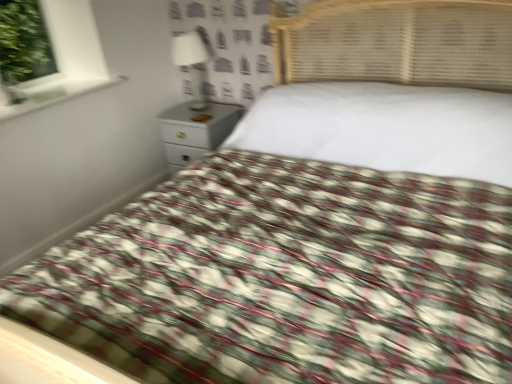
Question: From the image's perspective, is white glossy nightstand at upper center located above white glossy window sill at upper left?

Choices:
 (A) yes
 (B) no

Answer: (B)

Question: From the image's perspective, is white glossy nightstand at upper center below white glossy window sill at upper left?

Choices:
 (A) yes
 (B) no

Answer: (A)

Question: From a real-world perspective, is white glossy nightstand at upper center on top of white glossy window sill at upper left?

Choices:
 (A) yes
 (B) no

Answer: (B)

Question: Is white glossy nightstand at upper center to the left of white glossy window sill at upper left from the viewer's perspective?

Choices:
 (A) no
 (B) yes

Answer: (A)

Question: Does white glossy nightstand at upper center have a larger size compared to white glossy window sill at upper left?

Choices:
 (A) yes
 (B) no

Answer: (A)

Question: In terms of height, does white glossy lamp at upper center look taller or shorter compared to white glossy window sill at upper left?

Choices:
 (A) short
 (B) tall

Answer: (B)

Question: Considering the positions of white glossy lamp at upper center and white glossy window sill at upper left in the image, is white glossy lamp at upper center wider or thinner than white glossy window sill at upper left?

Choices:
 (A) wide
 (B) thin

Answer: (B)

Question: From a real-world perspective, relative to white glossy window sill at upper left, is white glossy lamp at upper center vertically above or below?

Choices:
 (A) above
 (B) below

Answer: (B)

Question: From the image's perspective, relative to white glossy window sill at upper left, is white glossy lamp at upper center above or below?

Choices:
 (A) below
 (B) above

Answer: (B)

Question: From the image's perspective, is white glossy window sill at upper left positioned above or below white glossy nightstand at upper center?

Choices:
 (A) below
 (B) above

Answer: (B)

Question: Is point (35, 79) positioned closer to the camera than point (163, 135)?

Choices:
 (A) farther
 (B) closer

Answer: (B)

Question: In terms of size, does white glossy window sill at upper left appear bigger or smaller than white glossy nightstand at upper center?

Choices:
 (A) small
 (B) big

Answer: (A)

Question: In the image, is white glossy window sill at upper left positioned in front of or behind white glossy nightstand at upper center?

Choices:
 (A) behind
 (B) front

Answer: (B)

Question: From a real-world perspective, is white glossy lamp at upper center physically located above or below white glossy nightstand at upper center?

Choices:
 (A) below
 (B) above

Answer: (B)

Question: From the image's perspective, is white glossy lamp at upper center located above or below white glossy nightstand at upper center?

Choices:
 (A) below
 (B) above

Answer: (B)